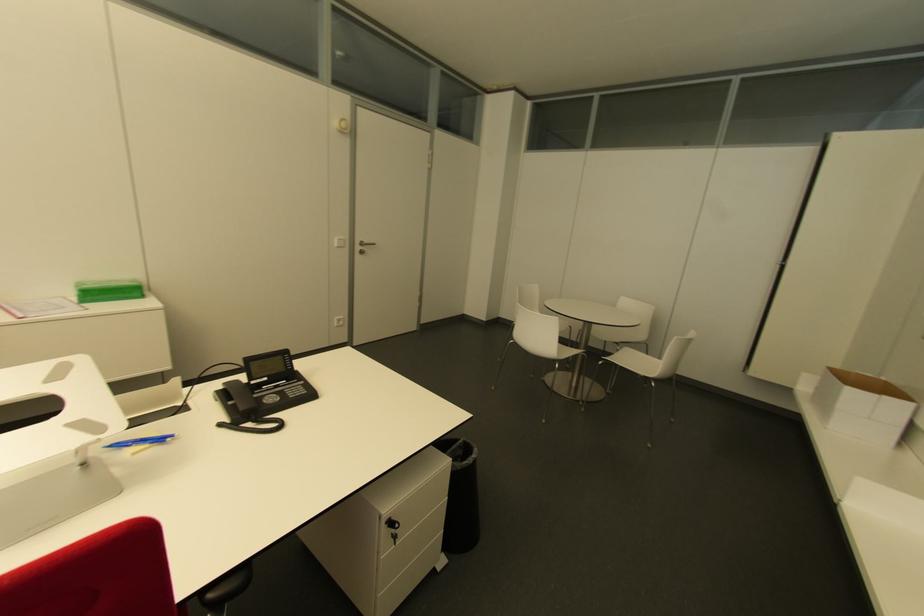
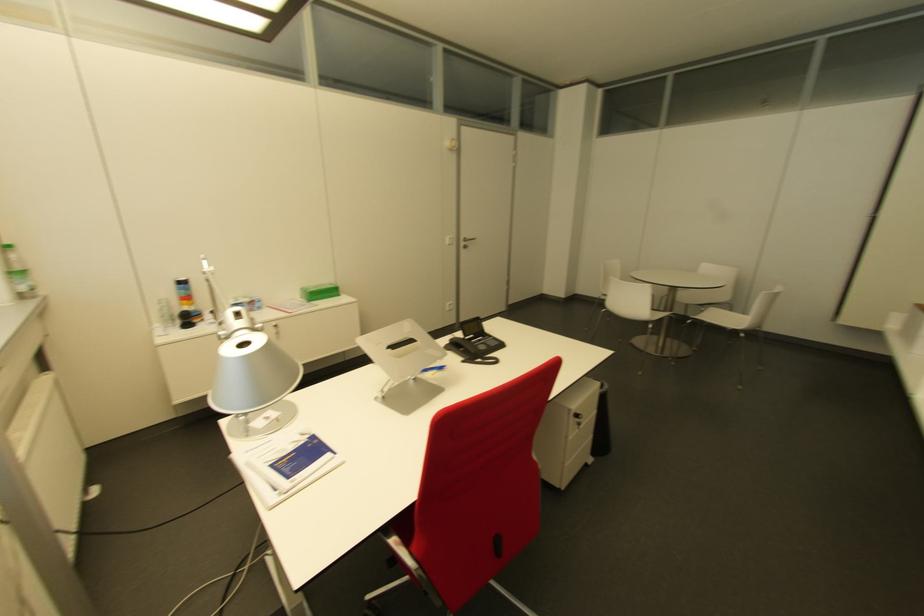
Where in the second image is the point corresponding to (x=299, y=383) from the first image?

(490, 338)